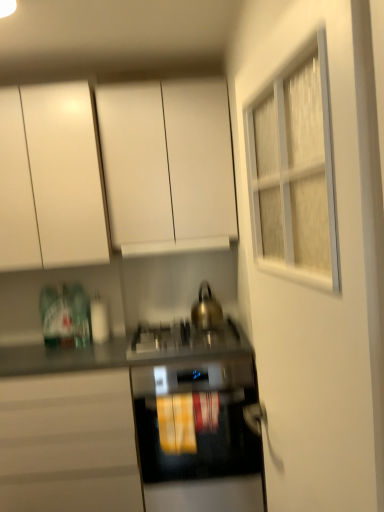
Question: Does metallic silver gas stove at center have a larger size compared to white matte cabinet at upper center, placed as the third cabinetry when sorted from bottom to top?

Choices:
 (A) yes
 (B) no

Answer: (B)

Question: Considering the relative positions of metallic silver gas stove at center and white matte cabinet at upper center, which ranks as the 1th cabinetry in top-to-bottom order, in the image provided, is metallic silver gas stove at center to the left of white matte cabinet at upper center, which ranks as the 1th cabinetry in top-to-bottom order, from the viewer's perspective?

Choices:
 (A) no
 (B) yes

Answer: (A)

Question: Is metallic silver gas stove at center taller than white matte cabinet at upper center, placed as the third cabinetry when sorted from bottom to top?

Choices:
 (A) yes
 (B) no

Answer: (B)

Question: Is metallic silver gas stove at center smaller than white matte cabinet at upper center, placed as the third cabinetry when sorted from bottom to top?

Choices:
 (A) yes
 (B) no

Answer: (A)

Question: Is metallic silver gas stove at center next to white matte cabinet at upper center, placed as the third cabinetry when sorted from bottom to top, and touching it?

Choices:
 (A) yes
 (B) no

Answer: (B)

Question: From their relative heights in the image, would you say white matte cabinet at upper center, placed as the third cabinetry when sorted from bottom to top, is taller or shorter than matte white cabinet at lower left, the third cabinetry positioned from the top?

Choices:
 (A) short
 (B) tall

Answer: (A)

Question: Is white matte cabinet at upper center, which ranks as the 1th cabinetry in top-to-bottom order, situated inside matte white cabinet at lower left, the third cabinetry positioned from the top, or outside?

Choices:
 (A) outside
 (B) inside

Answer: (A)

Question: In terms of size, does white matte cabinet at upper center, placed as the third cabinetry when sorted from bottom to top, appear bigger or smaller than matte white cabinet at lower left, which appears as the first cabinetry when ordered from the bottom?

Choices:
 (A) small
 (B) big

Answer: (A)

Question: Looking at their shapes, would you say white matte cabinet at upper center, which ranks as the 1th cabinetry in top-to-bottom order, is wider or thinner than matte white cabinet at lower left, the third cabinetry positioned from the top?

Choices:
 (A) thin
 (B) wide

Answer: (A)

Question: From their relative heights in the image, would you say matte white cabinet at lower left, the third cabinetry positioned from the top, is taller or shorter than black glass oven at center?

Choices:
 (A) tall
 (B) short

Answer: (A)

Question: In the image, is matte white cabinet at lower left, which appears as the first cabinetry when ordered from the bottom, positioned in front of or behind black glass oven at center?

Choices:
 (A) behind
 (B) front

Answer: (B)

Question: Which is correct: matte white cabinet at lower left, which appears as the first cabinetry when ordered from the bottom, is inside black glass oven at center, or outside of it?

Choices:
 (A) outside
 (B) inside

Answer: (A)

Question: From the image's perspective, is matte white cabinet at lower left, the third cabinetry positioned from the top, above or below black glass oven at center?

Choices:
 (A) above
 (B) below

Answer: (B)

Question: Considering the positions of matte white cabinet at lower left, the third cabinetry positioned from the top, and gold metallic kettle at center in the image, is matte white cabinet at lower left, the third cabinetry positioned from the top, taller or shorter than gold metallic kettle at center?

Choices:
 (A) short
 (B) tall

Answer: (B)

Question: From the image's perspective, is matte white cabinet at lower left, which appears as the first cabinetry when ordered from the bottom, positioned above or below gold metallic kettle at center?

Choices:
 (A) below
 (B) above

Answer: (A)